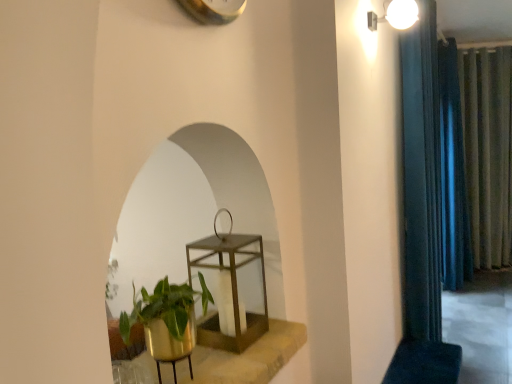
The image size is (512, 384). Describe the element at coordinates (246, 358) in the screenshot. I see `gold metallic plant pot at lower left` at that location.

At what (x,y) coordinates should I click in order to perform the action: click on gold metallic plant pot at lower left. Please return your answer as a coordinate pair (x, y). The width and height of the screenshot is (512, 384). Looking at the image, I should click on (246, 358).

Measure the distance between green textured curtain at right, which appears as the first curtain when viewed from the back, and camera.

green textured curtain at right, which appears as the first curtain when viewed from the back, is 4.84 meters away from camera.

Measure the distance between blue velvet curtain at right, which appears as the third curtain when viewed from the back, and camera.

blue velvet curtain at right, which appears as the third curtain when viewed from the back, and camera are 8.19 feet apart from each other.

Measure the distance between point (404, 8) and camera.

The depth of point (404, 8) is 2.04 meters.

Describe the element at coordinates (395, 15) in the screenshot. I see `white glossy light fixture at upper right` at that location.

The height and width of the screenshot is (384, 512). Find the location of `gold metallic plant pot at lower left`. gold metallic plant pot at lower left is located at coordinates (246, 358).

From a real-world perspective, is white glossy light fixture at upper right below gold metallic plant pot at lower left?

Actually, white glossy light fixture at upper right is physically above gold metallic plant pot at lower left in the real world.

Are white glossy light fixture at upper right and gold metallic plant pot at lower left beside each other?

There is a gap between white glossy light fixture at upper right and gold metallic plant pot at lower left.

Is point (397, 7) farther from viewer compared to point (290, 351)?

Yes, point (397, 7) is behind point (290, 351).

Is gold metallic plant pot at lower left inside white glossy light fixture at upper right?

No, gold metallic plant pot at lower left is not inside white glossy light fixture at upper right.

From the picture: Relative to gold metallic plant pot at lower left, is metallic gold lantern at center in front or behind?

In the image, metallic gold lantern at center appears behind gold metallic plant pot at lower left.

Can you confirm if metallic gold lantern at center is positioned to the right of gold metallic plant pot at lower left?

Yes.

Is metallic gold lantern at center with gold metallic plant pot at lower left?

metallic gold lantern at center is not next to gold metallic plant pot at lower left, and they're not touching.

Based on the photo, from the image's perspective, which one is positioned higher, metallic gold lantern at center or gold metallic plant pot at lower left?

metallic gold lantern at center is shown above in the image.

Can you confirm if blue velvet curtain at right, which appears as the third curtain when viewed from the back, is taller than gold metallic plant pot at lower left?

Indeed, blue velvet curtain at right, which appears as the third curtain when viewed from the back, has a greater height compared to gold metallic plant pot at lower left.

Is blue velvet curtain at right, the first curtain in the front-to-back sequence, facing towards gold metallic plant pot at lower left?

No, blue velvet curtain at right, the first curtain in the front-to-back sequence, is not facing towards gold metallic plant pot at lower left.

Considering the sizes of objects blue velvet curtain at right, acting as the first curtain starting from the left, and gold metallic plant pot at lower left in the image provided, who is smaller, blue velvet curtain at right, acting as the first curtain starting from the left, or gold metallic plant pot at lower left?

gold metallic plant pot at lower left is smaller.

Does blue velvet curtain at right, acting as the first curtain starting from the left, come in front of gold metallic plant pot at lower left?

No, blue velvet curtain at right, acting as the first curtain starting from the left, is further to the viewer.

Who is shorter, white glossy light fixture at upper right or blue velvet curtain at right, the first curtain in the front-to-back sequence?

white glossy light fixture at upper right is shorter.

Is white glossy light fixture at upper right positioned far away from blue velvet curtain at right, the first curtain in the front-to-back sequence?

No, white glossy light fixture at upper right is not far from blue velvet curtain at right, the first curtain in the front-to-back sequence.

Is white glossy light fixture at upper right to the right of blue velvet curtain at right, which is counted as the 3th curtain, starting from the right, from the viewer's perspective?

In fact, white glossy light fixture at upper right is to the left of blue velvet curtain at right, which is counted as the 3th curtain, starting from the right.

Can you confirm if white glossy light fixture at upper right is smaller than blue velvet curtain at right, which is counted as the 3th curtain, starting from the right?

Correct, white glossy light fixture at upper right occupies less space than blue velvet curtain at right, which is counted as the 3th curtain, starting from the right.

Is green textured curtain at right, which appears as the first curtain when viewed from the back, at the back of dark blue fabric curtain at right, the 2th curtain viewed from the left?

No, dark blue fabric curtain at right, the 2th curtain viewed from the left, is not facing away from green textured curtain at right, which appears as the first curtain when viewed from the back.

From the image's perspective, is dark blue fabric curtain at right, the second curtain in the back-to-front sequence, below green textured curtain at right, which appears as the first curtain when viewed from the back?

Yes, from the image's perspective, dark blue fabric curtain at right, the second curtain in the back-to-front sequence, is beneath green textured curtain at right, which appears as the first curtain when viewed from the back.

Considering their positions, is dark blue fabric curtain at right, which appears as the 2th curtain when viewed from the right, located in front of or behind green textured curtain at right, the first curtain from the right?

Visually, dark blue fabric curtain at right, which appears as the 2th curtain when viewed from the right, is located in front of green textured curtain at right, the first curtain from the right.

Is dark blue fabric curtain at right, the second curtain in the back-to-front sequence, not close to green textured curtain at right, the first curtain from the right?

dark blue fabric curtain at right, the second curtain in the back-to-front sequence, is actually quite close to green textured curtain at right, the first curtain from the right.

Would you say dark blue fabric curtain at right, which appears as the 2th curtain when viewed from the right, is to the left or to the right of blue velvet curtain at right, which appears as the third curtain when viewed from the back, in the picture?

Based on their positions, dark blue fabric curtain at right, which appears as the 2th curtain when viewed from the right, is located to the right of blue velvet curtain at right, which appears as the third curtain when viewed from the back.

Is dark blue fabric curtain at right, the 2th curtain viewed from the left, beside blue velvet curtain at right, which appears as the third curtain when viewed from the back?

There is a gap between dark blue fabric curtain at right, the 2th curtain viewed from the left, and blue velvet curtain at right, which appears as the third curtain when viewed from the back.

Is dark blue fabric curtain at right, the 2th curtain viewed from the left, bigger or smaller than blue velvet curtain at right, which is counted as the 3th curtain, starting from the right?

Considering their sizes, dark blue fabric curtain at right, the 2th curtain viewed from the left, takes up more space than blue velvet curtain at right, which is counted as the 3th curtain, starting from the right.

Which of these two, metallic gold lantern at center or blue velvet curtain at right, acting as the first curtain starting from the left, is bigger?

Bigger between the two is blue velvet curtain at right, acting as the first curtain starting from the left.

Is point (243, 235) farther from viewer compared to point (415, 73)?

No, (243, 235) is in front of (415, 73).

From a real-world perspective, which is physically below, metallic gold lantern at center or blue velvet curtain at right, which is counted as the 3th curtain, starting from the right?

metallic gold lantern at center, from a real-world perspective.

At what (x,y) coordinates should I click in order to perform the action: click on light fixture above the gold metallic plant pot at lower left (from a real-world perspective). Please return your answer as a coordinate pair (x, y). The height and width of the screenshot is (384, 512). Looking at the image, I should click on (395, 15).

The width and height of the screenshot is (512, 384). I want to click on window sill below the metallic gold lantern at center (from a real-world perspective), so click(x=246, y=358).

Based on the photo, which object lies further to the anchor point dark blue fabric curtain at right, the 2th curtain viewed from the left, blue velvet curtain at right, the first curtain in the front-to-back sequence, or white glossy light fixture at upper right?

white glossy light fixture at upper right.

Based on the photo, estimate the real-world distances between objects in this image. Which object is further from white glossy light fixture at upper right, dark blue fabric curtain at right, the 2th curtain viewed from the left, or gold metallic plant pot at lower left?

The object further to white glossy light fixture at upper right is dark blue fabric curtain at right, the 2th curtain viewed from the left.

Based on their spatial positions, is white glossy light fixture at upper right or dark blue fabric curtain at right, acting as the 2th curtain starting from the front, further from blue velvet curtain at right, the first curtain in the front-to-back sequence?

dark blue fabric curtain at right, acting as the 2th curtain starting from the front, is positioned further to the anchor blue velvet curtain at right, the first curtain in the front-to-back sequence.

From the image, which object appears to be nearer to green textured curtain at right, the first curtain from the right, blue velvet curtain at right, the first curtain in the front-to-back sequence, or metallic gold lantern at center?

Among the two, blue velvet curtain at right, the first curtain in the front-to-back sequence, is located nearer to green textured curtain at right, the first curtain from the right.

Based on the photo, based on their spatial positions, is green textured curtain at right, the first curtain from the right, or blue velvet curtain at right, the first curtain in the front-to-back sequence, closer to dark blue fabric curtain at right, the second curtain in the back-to-front sequence?

green textured curtain at right, the first curtain from the right.

From the image, which object appears to be farther from gold metallic plant pot at lower left, white glossy light fixture at upper right or dark blue fabric curtain at right, the second curtain in the back-to-front sequence?

dark blue fabric curtain at right, the second curtain in the back-to-front sequence, is further to gold metallic plant pot at lower left.

Based on their spatial positions, is gold metallic plant pot at lower left or metallic gold lantern at center further from white glossy light fixture at upper right?

gold metallic plant pot at lower left is further to white glossy light fixture at upper right.

From the image, which object appears to be nearer to metallic gold lantern at center, dark blue fabric curtain at right, acting as the 2th curtain starting from the front, or white glossy light fixture at upper right?

white glossy light fixture at upper right is closer to metallic gold lantern at center.

I want to click on round table between gold metallic plant pot at lower left and blue velvet curtain at right, acting as the first curtain starting from the left, so click(231, 288).

You are a GUI agent. You are given a task and a screenshot of the screen. Output one action in this format:
    pyautogui.click(x=<x>, y=<y>)
    Task: Click on the curtain located between blue velvet curtain at right, which appears as the third curtain when viewed from the back, and green textured curtain at right, which is counted as the 3th curtain, starting from the left, in the depth direction
    This screenshot has height=384, width=512.
    Given the screenshot: What is the action you would take?
    pyautogui.click(x=452, y=174)

Identify the location of curtain located between white glossy light fixture at upper right and dark blue fabric curtain at right, which appears as the 2th curtain when viewed from the right, in the depth direction. (421, 177).

Where is `curtain located between gold metallic plant pot at lower left and dark blue fabric curtain at right, which appears as the 2th curtain when viewed from the right, in the depth direction`? curtain located between gold metallic plant pot at lower left and dark blue fabric curtain at right, which appears as the 2th curtain when viewed from the right, in the depth direction is located at coordinates (421, 177).